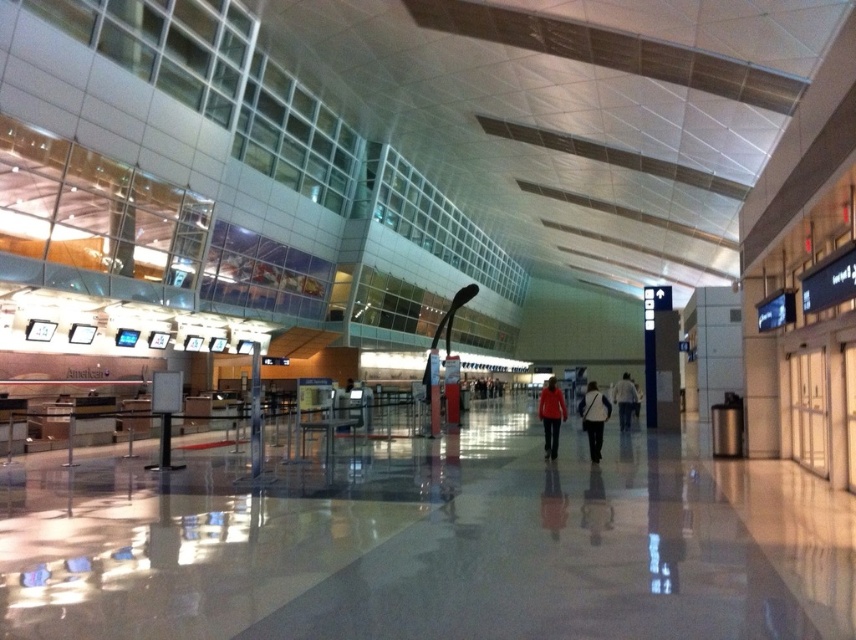
Question: Which of the following is the farthest from the observer?

Choices:
 (A) (593, 384)
 (B) (629, 394)
 (C) (551, 400)

Answer: (A)

Question: Can you confirm if white fabric bag at center is wider than matte red jacket at center?

Choices:
 (A) no
 (B) yes

Answer: (B)

Question: Which point is closer to the camera?

Choices:
 (A) (599, 394)
 (B) (625, 426)
 (C) (550, 417)

Answer: (A)

Question: Where is white fabric bag at center located in relation to light blue jeans at center in the image?

Choices:
 (A) left
 (B) right

Answer: (A)

Question: Which of the following is the farthest from the observer?

Choices:
 (A) (628, 376)
 (B) (583, 429)

Answer: (A)

Question: Can you confirm if white fabric bag at center is positioned above light blue jeans at center?

Choices:
 (A) yes
 (B) no

Answer: (B)